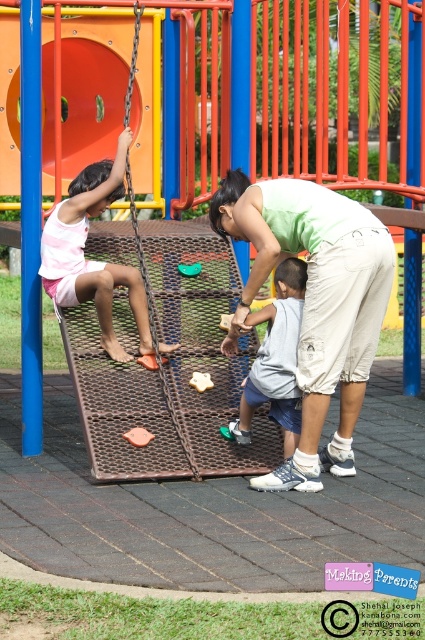
You are a parent at the playground and see the gray fabric shorts at center and the rubberized plastic toy at center. Which object is closer to you?

The gray fabric shorts at center is in front of the rubberized plastic toy at center, so it is closer to you.

You are a photographer trying to capture a candid shot of the two children playing at the playground. You notice the green cotton shirt at center and the pink fabric shorts at left. Which object should you focus on first if you want to take a photo that includes both subjects without moving the camera? Explain your reasoning based on their positions.

You should focus on the green cotton shirt at center first because it is in front of the pink fabric shorts at left. By focusing on the closer subject, the depth of field may still capture the background subject adequately, ensuring both are in reasonable focus without needing to adjust the camera position.

Please look at the playground scene. There is a woman in a light green sleeveless top and beige shorts, a child in a gray sleeveless shirt and dark shorts, and another child in a pink and white striped sleeveless top and. Can you tell me what is located at the point marked as (275,360)?

The point marked as 0.564, 0649 marks gray fabric shorts at center.